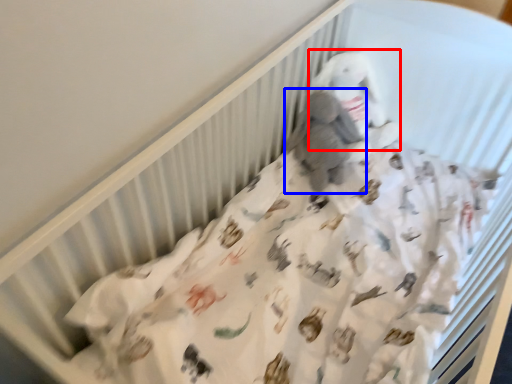
Question: Which object is closer to the camera taking this photo, toy (highlighted by a red box) or baby elephant (highlighted by a blue box)?

Choices:
 (A) toy
 (B) baby elephant

Answer: (B)